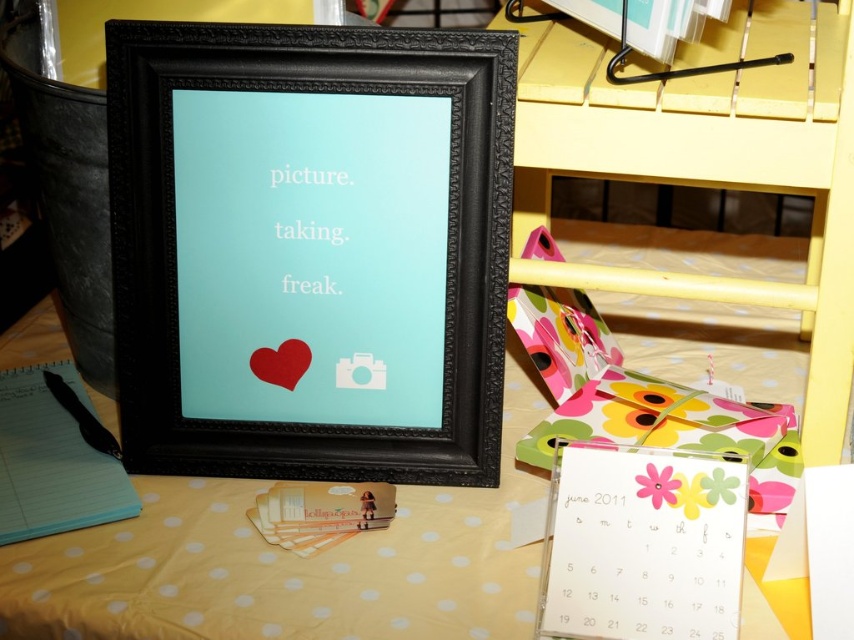
Question: Is yellow wood bunk bed at lower right bigger than white paper calendar at lower right?

Choices:
 (A) no
 (B) yes

Answer: (B)

Question: Which object appears closest to the camera in this image?

Choices:
 (A) white paper calendar at lower right
 (B) yellow dotted fabric at center
 (C) yellow wood bunk bed at lower right
 (D) black matte pen at lower left

Answer: (A)

Question: Among these objects, which one is nearest to the camera?

Choices:
 (A) black matte pen at lower left
 (B) yellow dotted fabric at center
 (C) yellow wood bunk bed at lower right

Answer: (B)

Question: Does white paper calendar at lower right have a smaller size compared to black matte pen at lower left?

Choices:
 (A) yes
 (B) no

Answer: (B)

Question: Considering the relative positions of white paper calendar at lower right and black matte pen at lower left in the image provided, where is white paper calendar at lower right located with respect to black matte pen at lower left?

Choices:
 (A) below
 (B) above

Answer: (A)

Question: Which point is farther from the camera taking this photo?

Choices:
 (A) (571, 445)
 (B) (215, 500)
 (C) (101, 442)

Answer: (C)